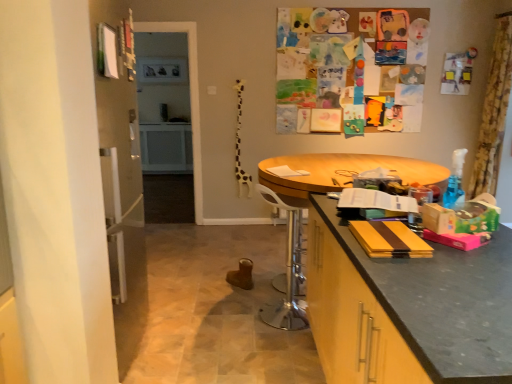
Identify the location of vacant position to the left of wooden round table at center. (206, 320).